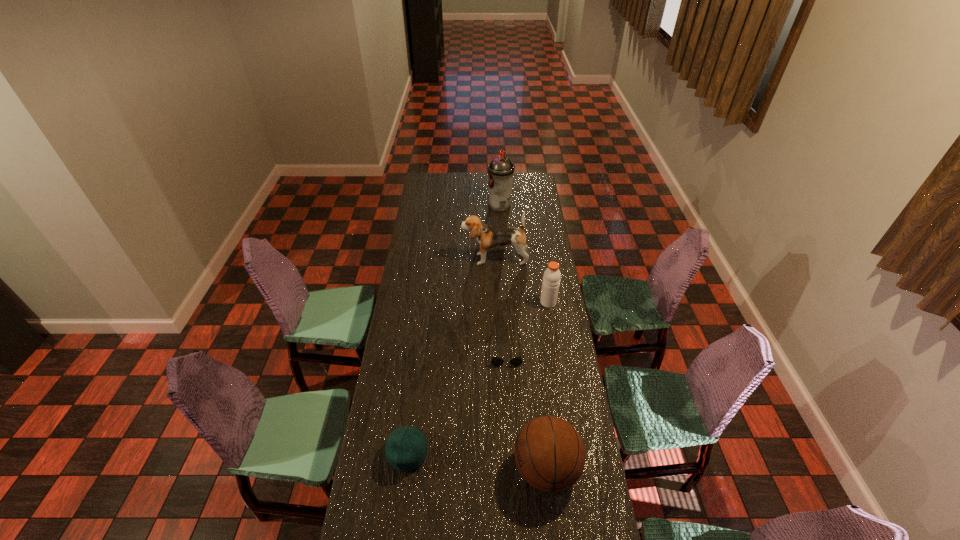
Where is `aerosol can`? aerosol can is located at coordinates (500, 170).

This screenshot has width=960, height=540. What are the coordinates of `the farthest object` in the screenshot? It's located at (500, 170).

You are a GUI agent. You are given a task and a screenshot of the screen. Output one action in this format:
    pyautogui.click(x=<x>, y=<y>)
    Task: Click on the fifth nearest object
    The width and height of the screenshot is (960, 540).
    Given the screenshot: What is the action you would take?
    pyautogui.click(x=488, y=237)

I want to click on puppy, so click(488, 237).

This screenshot has height=540, width=960. Identify the location of the fourth nearest object. (551, 279).

Identify the location of basketball. The height and width of the screenshot is (540, 960). (550, 455).

The image size is (960, 540). In order to click on the fifth tallest object in this screenshot , I will do `click(406, 448)`.

I want to click on beanie, so click(x=406, y=448).

Locate an element on the screen. Image resolution: width=960 pixels, height=540 pixels. sunglasses is located at coordinates (496, 361).

At what (x,y) coordinates should I click in order to perform the action: click on the shortest object. Please return your answer as a coordinate pair (x, y). This screenshot has width=960, height=540. Looking at the image, I should click on (496, 361).